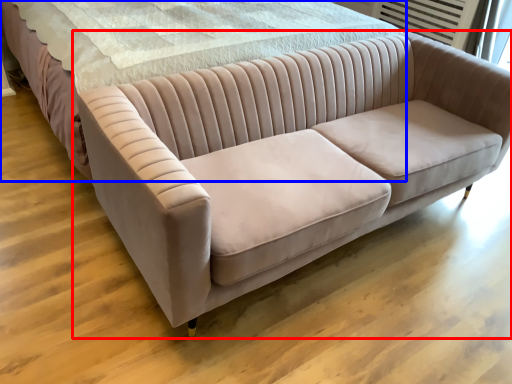
Question: Which object appears closest to the camera in this image, studio couch (highlighted by a red box) or bed (highlighted by a blue box)?

Choices:
 (A) studio couch
 (B) bed

Answer: (A)